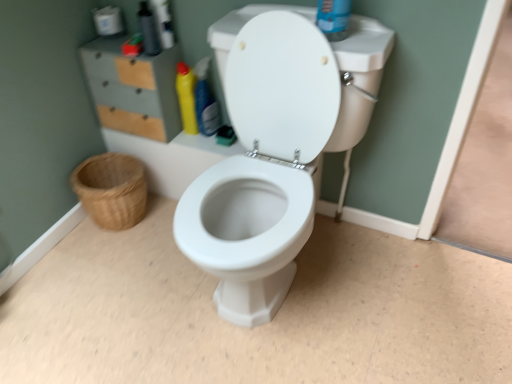
Question: Should I look upward or downward to see white matte toilet paper at upper left?

Choices:
 (A) down
 (B) up

Answer: (B)

Question: In which direction should I rotate to look at yellow glossy bottle at center, which is the 2th cleaning product in left-to-right order?

Choices:
 (A) right
 (B) left

Answer: (B)

Question: Is matte gray/file cabinet at upper left shorter than woven natural basket at lower left?

Choices:
 (A) yes
 (B) no

Answer: (B)

Question: Is matte gray/file cabinet at upper left looking in the opposite direction of woven natural basket at lower left?

Choices:
 (A) yes
 (B) no

Answer: (B)

Question: Is matte gray/file cabinet at upper left at the right side of woven natural basket at lower left?

Choices:
 (A) no
 (B) yes

Answer: (B)

Question: Considering the relative sizes of matte gray/file cabinet at upper left and woven natural basket at lower left in the image provided, is matte gray/file cabinet at upper left taller than woven natural basket at lower left?

Choices:
 (A) yes
 (B) no

Answer: (A)

Question: Are matte gray/file cabinet at upper left and woven natural basket at lower left located far from each other?

Choices:
 (A) yes
 (B) no

Answer: (B)

Question: Is woven natural basket at lower left located within matte gray/file cabinet at upper left?

Choices:
 (A) yes
 (B) no

Answer: (B)

Question: From the image's perspective, would you say woven natural basket at lower left is positioned over yellow glossy bottle at center, which is the 2th cleaning product in left-to-right order?

Choices:
 (A) yes
 (B) no

Answer: (B)

Question: Could you tell me if woven natural basket at lower left is turned towards yellow glossy bottle at center, which is the 2th cleaning product in left-to-right order?

Choices:
 (A) no
 (B) yes

Answer: (A)

Question: From a real-world perspective, is woven natural basket at lower left physically below yellow glossy bottle at center, positioned as the 1th cleaning product in right-to-left order?

Choices:
 (A) no
 (B) yes

Answer: (B)

Question: From the image's perspective, would you say woven natural basket at lower left is shown under yellow glossy bottle at center, which is the 2th cleaning product in left-to-right order?

Choices:
 (A) yes
 (B) no

Answer: (A)

Question: From a real-world perspective, is woven natural basket at lower left over yellow glossy bottle at center, which is the 2th cleaning product in left-to-right order?

Choices:
 (A) yes
 (B) no

Answer: (B)

Question: Is woven natural basket at lower left with yellow glossy bottle at center, which is the 2th cleaning product in left-to-right order?

Choices:
 (A) no
 (B) yes

Answer: (A)

Question: From a real-world perspective, is yellow glossy bottle at center, which is the 2th cleaning product in left-to-right order, positioned over matte gray/file cabinet at upper left based on gravity?

Choices:
 (A) no
 (B) yes

Answer: (A)